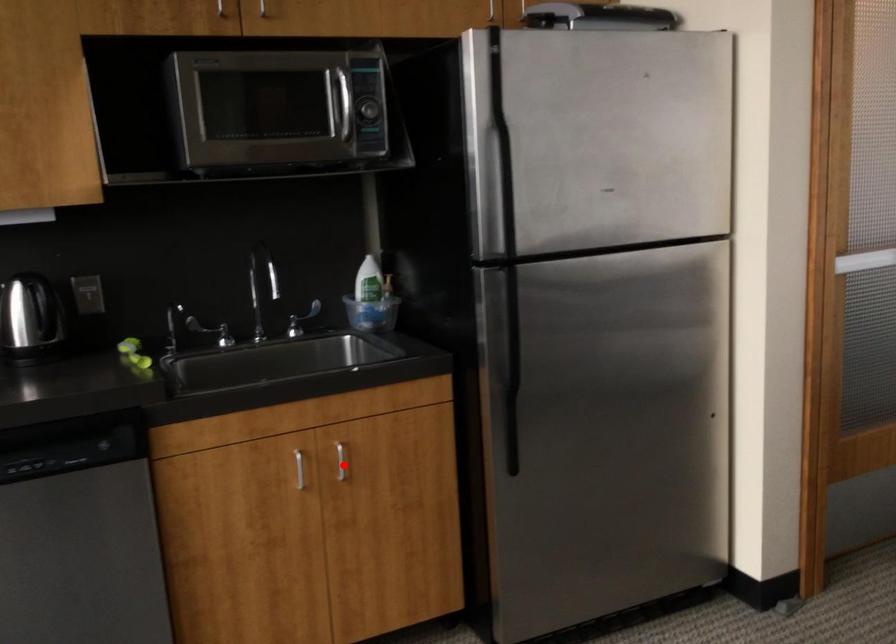
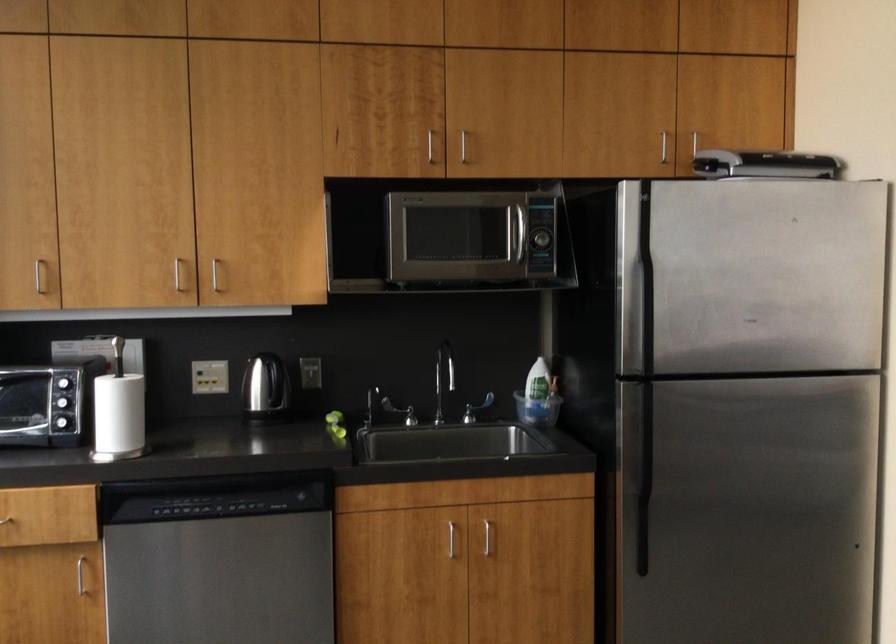
Question: I am providing you with two images of the same scene from different viewpoints. A red point is shown in image1. For the corresponding object point in image2, is it positioned nearer or farther from the camera?

Choices:
 (A) Nearer
 (B) Farther

Answer: (B)